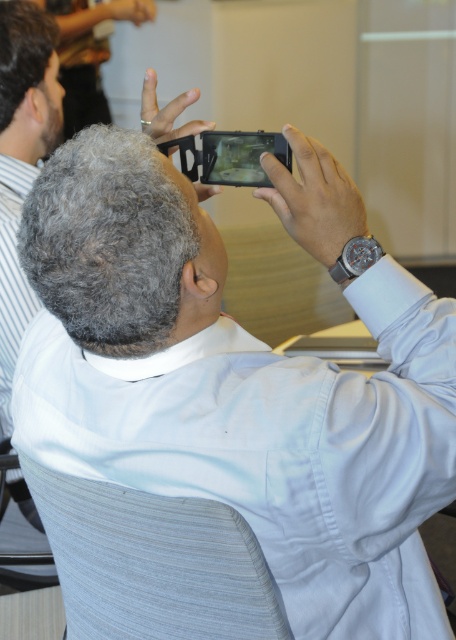
You are an interior designer assessing the layout of a conference room. You notice the light gray woven fabric chair at lower center and the satin silver watch at upper right. Which object is positioned closer to the left side of the room?

The light gray woven fabric chair at lower center is positioned closer to the left side of the room because it is to the left of the satin silver watch at upper right.

You are an interior designer planning to place a new lamp in the room. The lamp needs to be positioned between the light gray woven fabric chair at lower center and the satin silver watch at upper right. Based on their spatial relationship, where should the lamp be placed?

The light gray woven fabric chair at lower center is in front of the satin silver watch at upper right, so the lamp should be placed between them, closer to the chair since it is positioned in front.